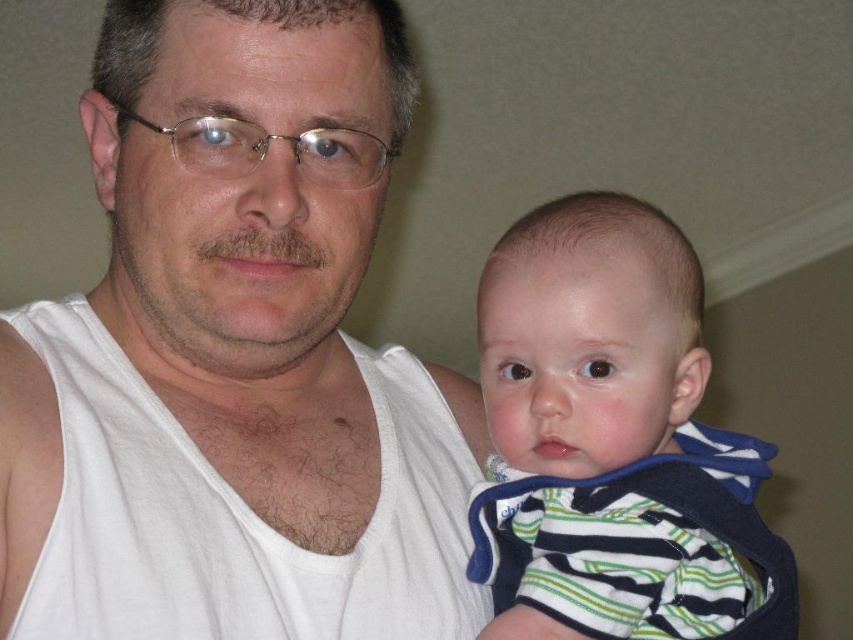
Question: Among these objects, which one is nearest to the camera?

Choices:
 (A) striped cotton onesie at center
 (B) striped cotton vest at center

Answer: (A)

Question: Can you confirm if striped cotton onesie at center is positioned to the right of striped cotton vest at center?

Choices:
 (A) no
 (B) yes

Answer: (A)

Question: Which of the following is the closest to the observer?

Choices:
 (A) (544, 508)
 (B) (135, 605)

Answer: (B)

Question: Does white tank top at center appear under striped cotton onesie at center?

Choices:
 (A) yes
 (B) no

Answer: (B)

Question: From the image, what is the correct spatial relationship of white tank top at center in relation to striped cotton onesie at center?

Choices:
 (A) left
 (B) right

Answer: (A)

Question: Which of the following is the closest to the observer?

Choices:
 (A) striped cotton onesie at center
 (B) white tank top at center

Answer: (B)